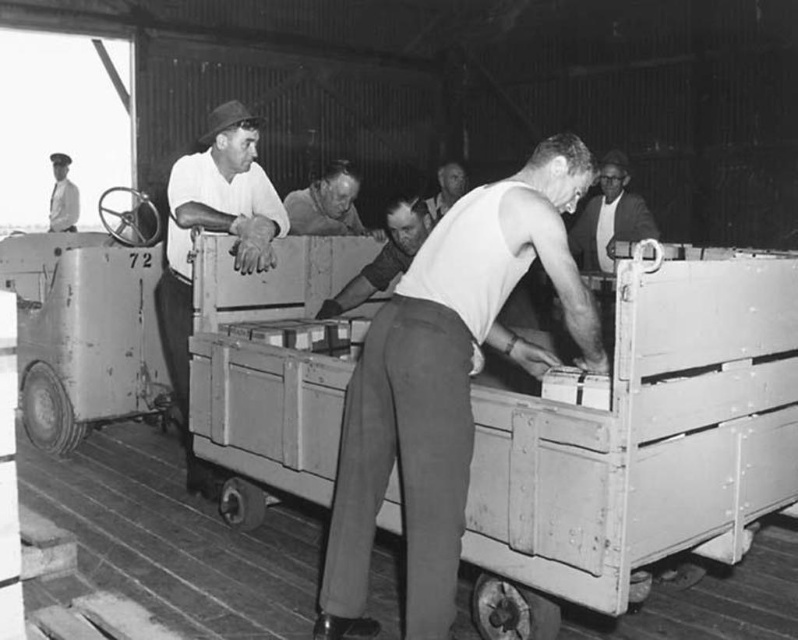
You are standing at the entrance of the warehouse and see two points marked in the scene. Which point is closer to you, point (350,173) or point (453,163)?

Point (350,173) is in front of point (453,163), so it is closer to you.

You are a worker in this warehouse and need to reach the smooth white shirt at center to hand over a document. The wooden crate at center is blocking your path. Can you step over it?

The wooden crate at center is below smooth white shirt at center, so yes, you can step over the wooden crate at center to reach the smooth white shirt at center.

From the picture: You are an observer looking at the scene. There is a smooth skin face at center and a smooth white shirt at center in the image. Which one is positioned more to the left?

The smooth skin face at center is positioned more to the left than the smooth white shirt at center.